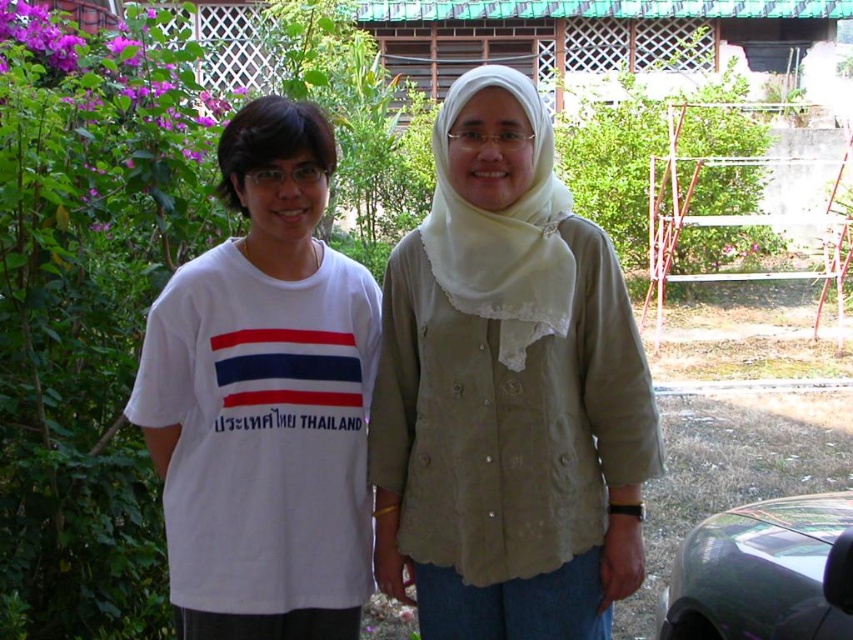
Which is more to the left, white matte shirt at center or white cotton t-shirt at left?

Positioned to the left is white cotton t-shirt at left.

Is point (474, 301) farther from viewer compared to point (299, 289)?

No, it is in front of (299, 289).

Is point (514, 99) more distant than point (256, 282)?

No, it is in front of (256, 282).

At what (x,y) coordinates should I click in order to perform the action: click on white matte shirt at center. Please return your answer as a coordinate pair (x, y). The width and height of the screenshot is (853, 640). Looking at the image, I should click on (508, 392).

Does white cotton t-shirt at left lie behind shiny metallic car at lower right?

Yes, white cotton t-shirt at left is behind shiny metallic car at lower right.

Consider the image. How far apart are white cotton t-shirt at left and shiny metallic car at lower right?

white cotton t-shirt at left is 4.97 feet away from shiny metallic car at lower right.

Who is more forward, [347,397] or [752,531]?

Point [347,397]

The height and width of the screenshot is (640, 853). What are the coordinates of `white cotton t-shirt at left` in the screenshot? It's located at (264, 400).

Is white matte shirt at center to the left of shiny metallic car at lower right from the viewer's perspective?

Indeed, white matte shirt at center is positioned on the left side of shiny metallic car at lower right.

Consider the image. Which is above, white matte shirt at center or shiny metallic car at lower right?

Positioned higher is white matte shirt at center.

The height and width of the screenshot is (640, 853). In order to click on white matte shirt at center in this screenshot , I will do click(508, 392).

Where is `white matte shirt at center`? This screenshot has height=640, width=853. white matte shirt at center is located at coordinates (508, 392).